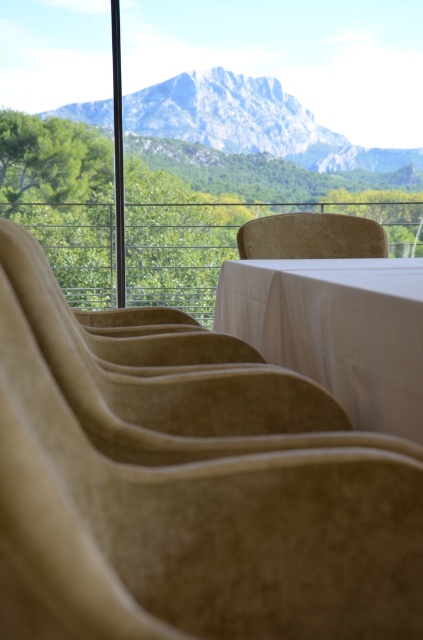
You are a guest at an outdoor event and want to sit down. You see the beige fabric armchair at center and the beige fabric chair at center. Which one is closer to you?

The beige fabric armchair at center is closer to you because it is in front of the beige fabric chair at center.

You are planning to seat VIP guests in the beige fabric armchair at center and beige fabric chair at center. Which one is more spacious for comfort?

The beige fabric armchair at center is larger in size compared to the beige fabric chair at center, so it offers more spacious seating for VIP guests.